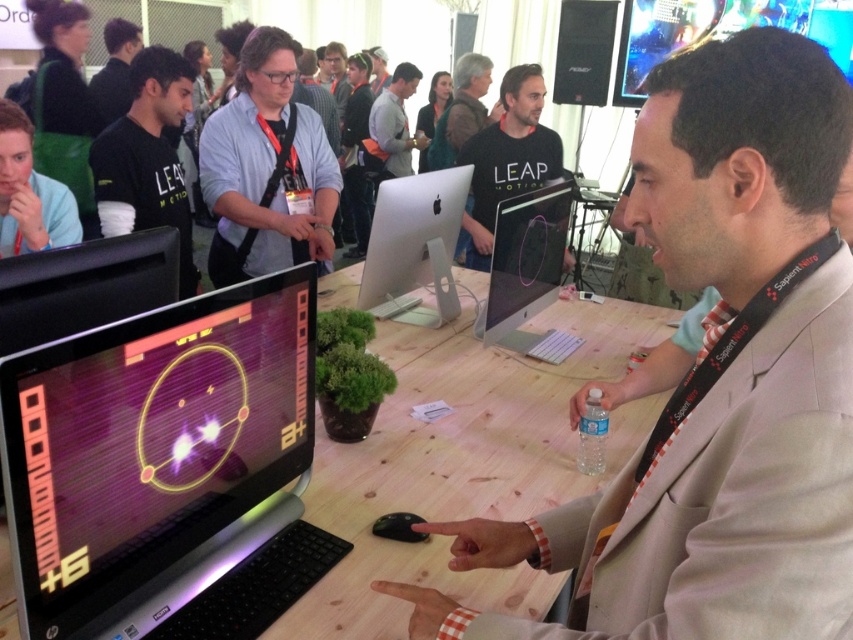
Measure the distance from sleek silver monitor at center to black matte shirt at center.

sleek silver monitor at center and black matte shirt at center are 38.94 inches apart from each other.

The image size is (853, 640). Describe the element at coordinates (525, 262) in the screenshot. I see `sleek silver monitor at center` at that location.

Is point (544, 224) positioned in front of point (463, 156)?

Yes.

Find the location of a particular element. sleek silver monitor at center is located at coordinates (525, 262).

Is silver metallic imac at center smaller than black matte shirt at center?

Yes.

Which is above, silver metallic imac at center or black matte shirt at center?

black matte shirt at center is above.

Does point (364, 260) come farther from viewer compared to point (540, 88)?

No.

Locate an element on the screen. Image resolution: width=853 pixels, height=640 pixels. silver metallic imac at center is located at coordinates (415, 243).

Based on the photo, is black matte shirt at center to the right of dark gray shirt at upper left from the viewer's perspective?

Correct, you'll find black matte shirt at center to the right of dark gray shirt at upper left.

Does black matte shirt at center have a greater height compared to dark gray shirt at upper left?

In fact, black matte shirt at center may be shorter than dark gray shirt at upper left.

Does point (534, 129) come in front of point (125, 60)?

Yes, it is in front of point (125, 60).

The image size is (853, 640). I want to click on black matte shirt at center, so click(x=508, y=157).